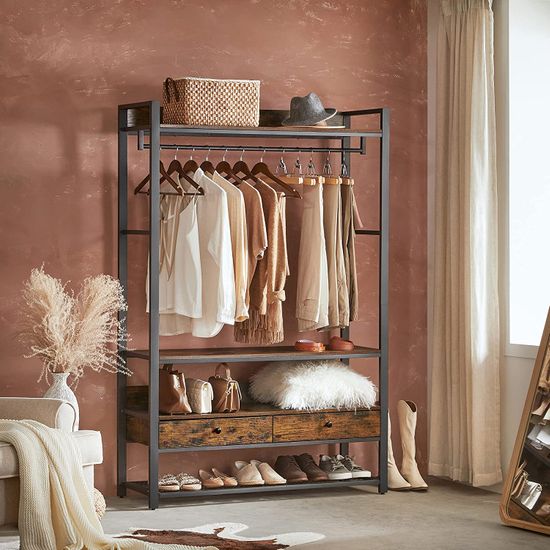
Where is `clothes hanging up`? The width and height of the screenshot is (550, 550). clothes hanging up is located at coordinates (189, 289), (214, 284), (240, 224), (253, 233), (268, 224), (279, 214), (309, 224), (327, 211), (346, 219).